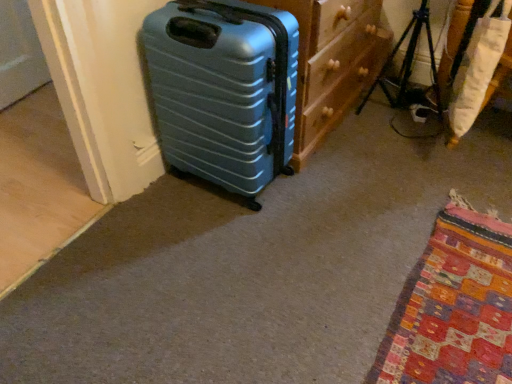
Question: Based on their positions, is wooden dresser at center located to the left or right of white fabric cushion at right?

Choices:
 (A) left
 (B) right

Answer: (A)

Question: Is point (292, 9) positioned closer to the camera than point (449, 135)?

Choices:
 (A) closer
 (B) farther

Answer: (A)

Question: Which of these objects is positioned closest to the white fabric cushion at right?

Choices:
 (A) teal plastic suitcase at left
 (B) wooden dresser at center
 (C) metallic tripod at center right

Answer: (C)

Question: Based on their relative distances, which object is farther from the wooden dresser at center?

Choices:
 (A) metallic tripod at center right
 (B) white fabric cushion at right
 (C) teal plastic suitcase at left

Answer: (B)